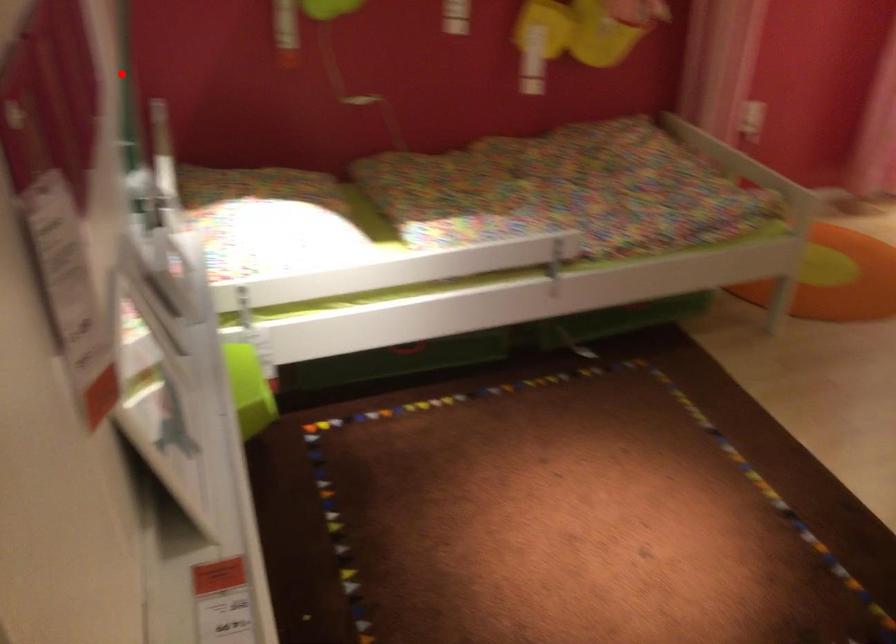
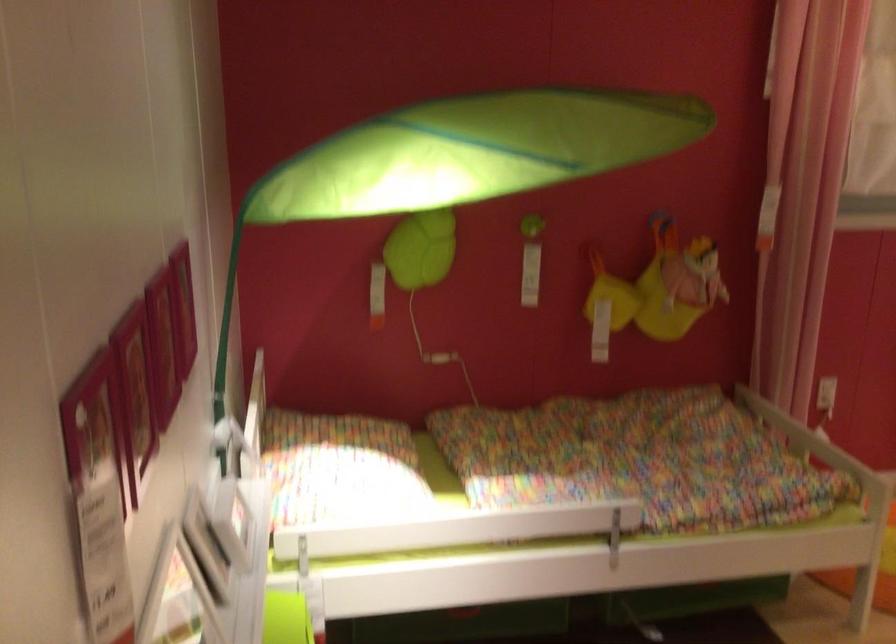
Find the pixel in the second image that matches the highlighted location in the first image.

(226, 339)